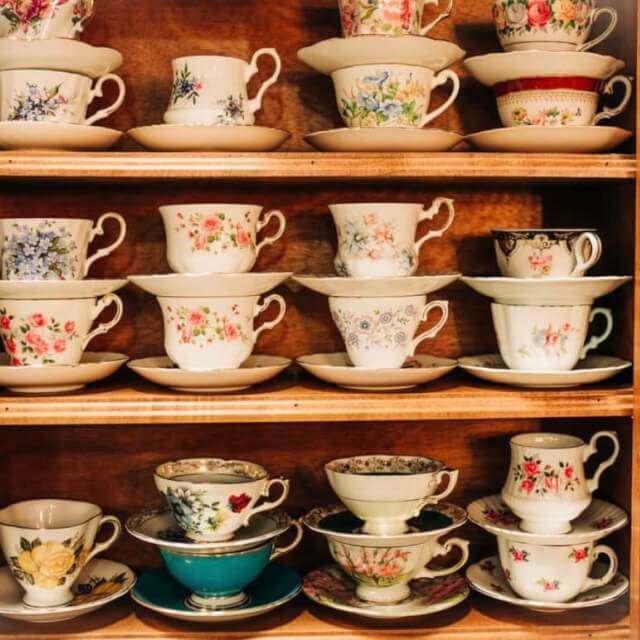
Find the location of `teacups that are stacked`. teacups that are stacked is located at coordinates (36, 10), (394, 13), (511, 17), (536, 230), (363, 242), (224, 239), (74, 244), (204, 502), (377, 498), (534, 489).